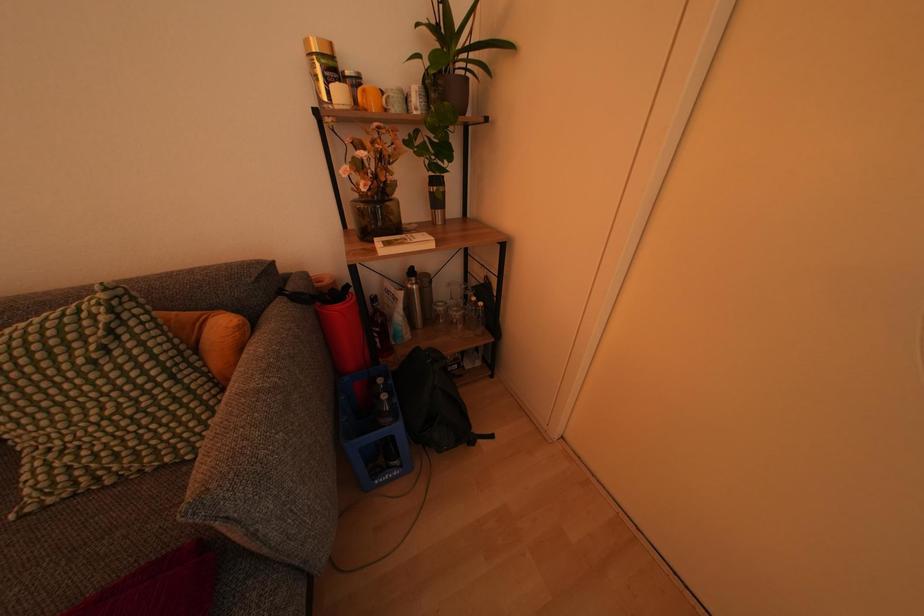
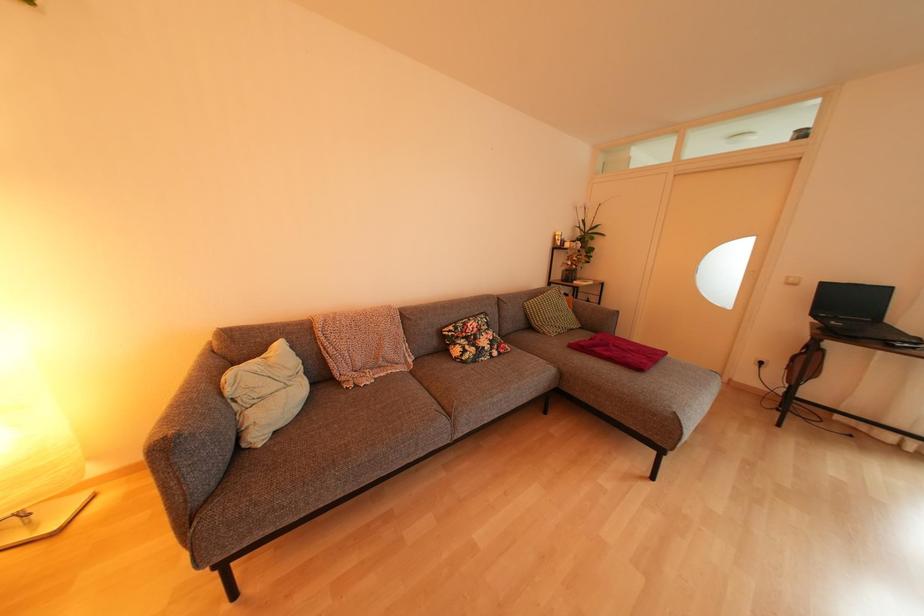
Looking at this image, what movement of the cameraman would produce the second image?

The cameraman walked toward left, backward.